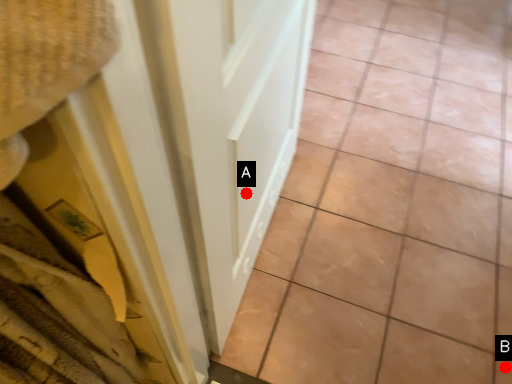
Question: Two points are circled on the image, labeled by A and B beside each circle. Which point is closer to the camera?

Choices:
 (A) A is closer
 (B) B is closer

Answer: (A)